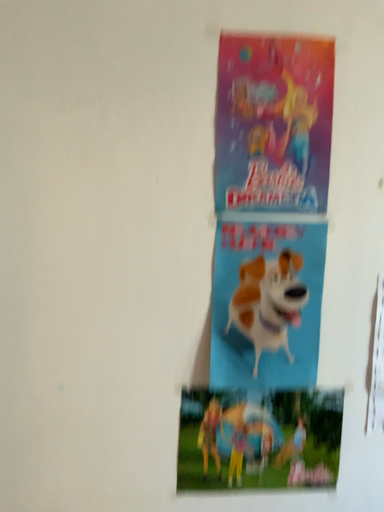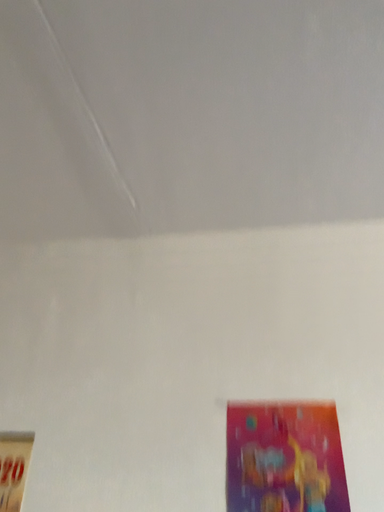
Question: How did the camera likely rotate when shooting the video?

Choices:
 (A) rotated downward
 (B) rotated upward

Answer: (B)